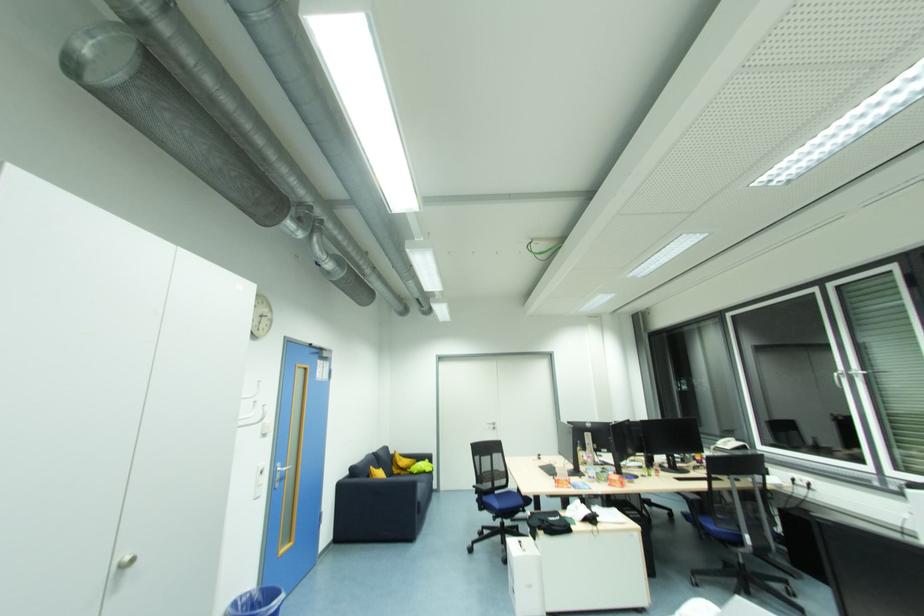
Where would you pull the white cabinet knob? Please return your answer as a coordinate pair (x, y).

(127, 561)